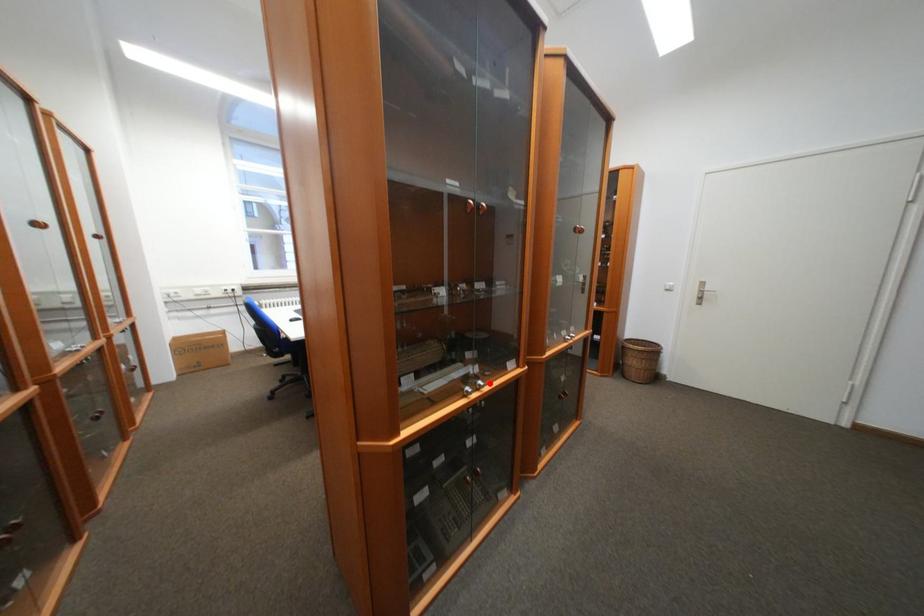
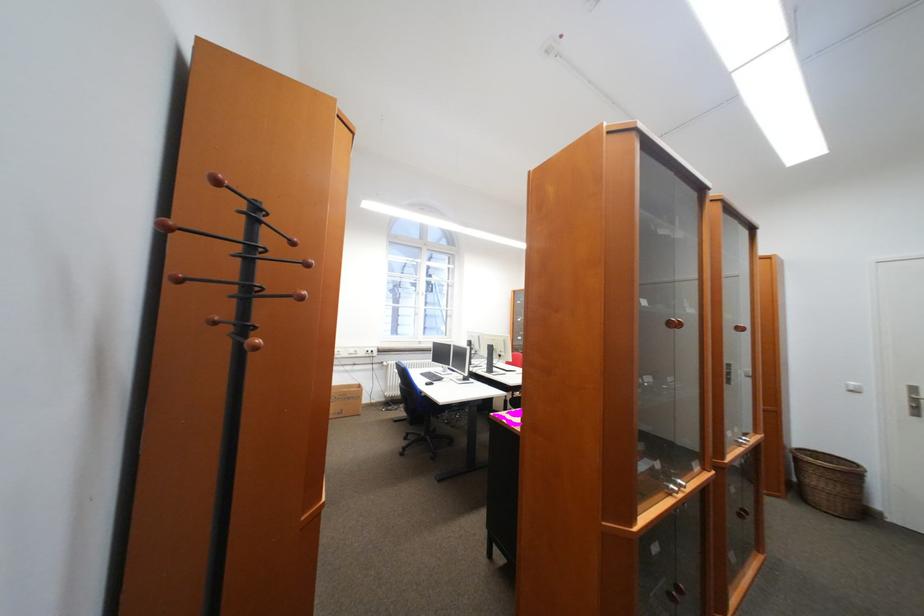
Find the pixel in the second image that matches the highlighted location in the first image.

(689, 482)